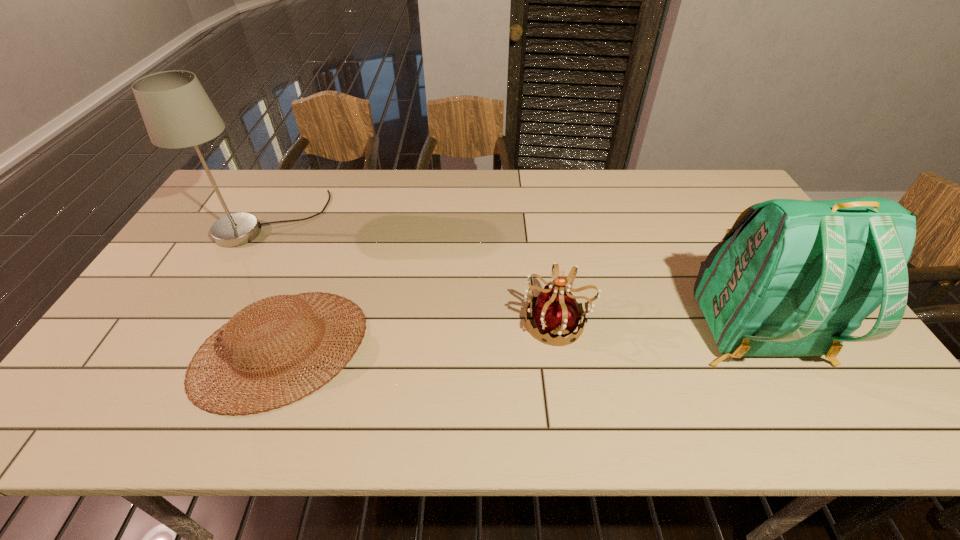
Locate an element on the screen. vacant space that is in between the farthest object and the backpack is located at coordinates (513, 276).

Locate an element on the screen. The width and height of the screenshot is (960, 540). free space between the rightmost object and the farthest object is located at coordinates (513, 276).

You are a GUI agent. You are given a task and a screenshot of the screen. Output one action in this format:
    pyautogui.click(x=<x>, y=<y>)
    Task: Click on the free area in between the sunhat and the farthest object
    Image resolution: width=960 pixels, height=540 pixels.
    Given the screenshot: What is the action you would take?
    pyautogui.click(x=276, y=284)

The width and height of the screenshot is (960, 540). In order to click on free spot between the backpack and the table lamp in this screenshot , I will do `click(513, 276)`.

The image size is (960, 540). I want to click on free spot between the second object from right to left and the table lamp, so click(414, 271).

Where is `free space that is in between the rightmost object and the sunhat`? This screenshot has width=960, height=540. free space that is in between the rightmost object and the sunhat is located at coordinates (517, 340).

Locate an element on the screen. free space between the third tallest object and the table lamp is located at coordinates (414, 271).

The image size is (960, 540). What are the coordinates of `free spot between the rightmost object and the shortest object` in the screenshot? It's located at (517, 340).

Identify the location of vacant point located between the rightmost object and the shortest object. (517, 340).

The image size is (960, 540). Find the location of `free space that is in between the backpack and the sunhat`. free space that is in between the backpack and the sunhat is located at coordinates (517, 340).